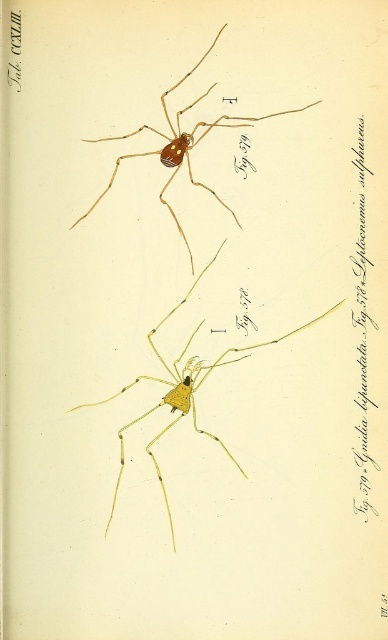
You are an entomologist examining two yellow matte spiders in the image. The yellow matte spider at center and the yellow matte spider at upper center. Which one has a wider body?

The yellow matte spider at center has a wider body than the yellow matte spider at upper center.